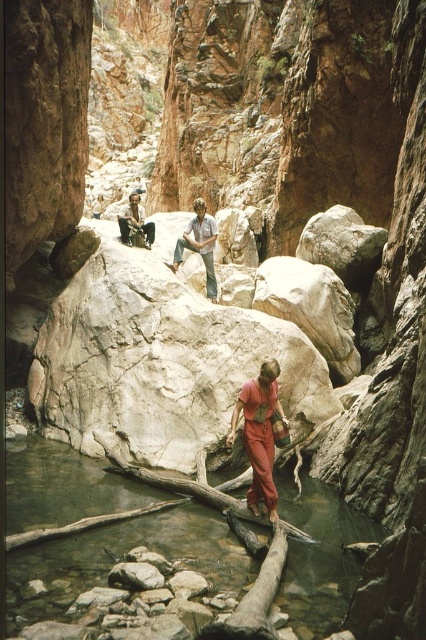
Question: Observing the image, what is the correct spatial positioning of clear water at creek center in reference to matte orange jumpsuit at center?

Choices:
 (A) below
 (B) above

Answer: (A)

Question: Which point is closer to the camera?

Choices:
 (A) (204, 243)
 (B) (296, 513)

Answer: (B)

Question: Which of the following is the closest to the observer?

Choices:
 (A) (256, 504)
 (B) (143, 220)
 (C) (181, 237)
 (D) (14, 573)

Answer: (D)

Question: Among these objects, which one is nearest to the camera?

Choices:
 (A) light blue denim jeans at center
 (B) matte orange jumpsuit at center
 (C) clear water at creek center
 (D) rusty metal camera at upper center

Answer: (C)

Question: Does clear water at creek center appear on the right side of light blue denim jeans at center?

Choices:
 (A) yes
 (B) no

Answer: (A)

Question: Does matte orange jumpsuit at center have a greater width compared to rusty metal camera at upper center?

Choices:
 (A) yes
 (B) no

Answer: (B)